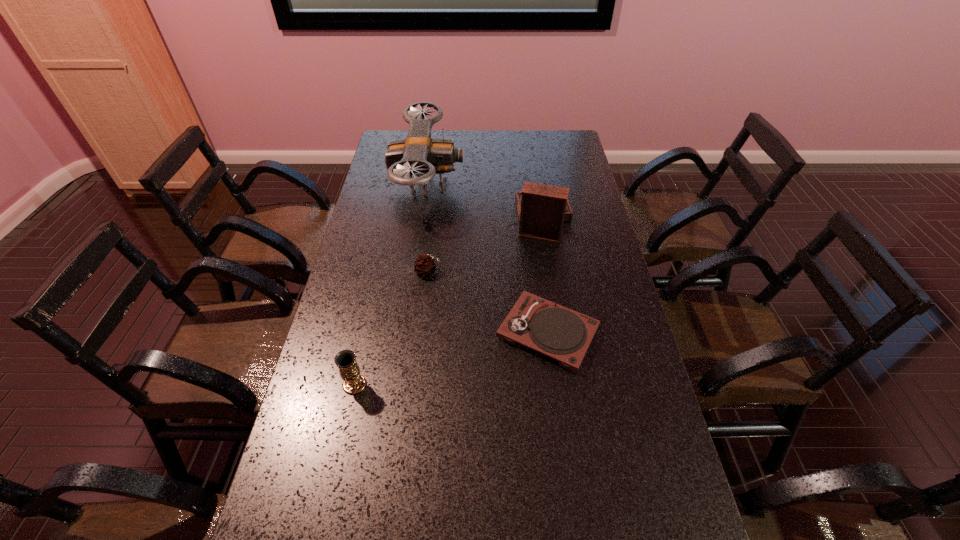
Where is `vacant space at the far left corner of the desktop`? vacant space at the far left corner of the desktop is located at coordinates (396, 139).

Image resolution: width=960 pixels, height=540 pixels. Identify the location of free space between the shorter phonograph_record and the fourth shortest object. (542, 276).

Where is `unoccupied position between the pinecone and the drone`? unoccupied position between the pinecone and the drone is located at coordinates (428, 228).

The width and height of the screenshot is (960, 540). What are the coordinates of `vacant area between the fourth shortest object and the chalice` in the screenshot? It's located at (446, 302).

The width and height of the screenshot is (960, 540). In order to click on free area in between the nearer phonograph_record and the farther phonograph_record in this screenshot , I will do `click(542, 276)`.

You are a GUI agent. You are given a task and a screenshot of the screen. Output one action in this format:
    pyautogui.click(x=<x>, y=<y>)
    Task: Click on the vacant space that's between the tallest object and the third farthest object
    Image resolution: width=960 pixels, height=540 pixels.
    Given the screenshot: What is the action you would take?
    pyautogui.click(x=428, y=228)

Find the location of a particular element. empty space between the pinecone and the farther phonograph_record is located at coordinates (483, 246).

The width and height of the screenshot is (960, 540). What are the coordinates of `free space between the nearer phonograph_record and the third farthest object` in the screenshot? It's located at (488, 302).

Where is `empty space that is in between the shorter phonograph_record and the pinecone`? empty space that is in between the shorter phonograph_record and the pinecone is located at coordinates (488, 302).

Where is `vacant region between the farther phonograph_record and the chalice`? The width and height of the screenshot is (960, 540). vacant region between the farther phonograph_record and the chalice is located at coordinates (446, 302).